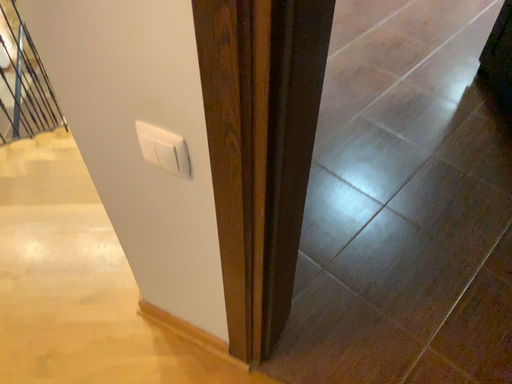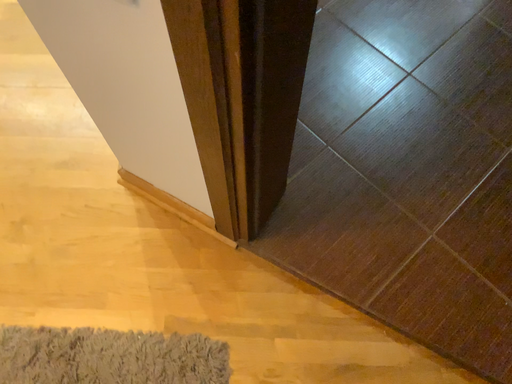
Question: How did the camera likely rotate when shooting the video?

Choices:
 (A) rotated downward
 (B) rotated upward

Answer: (A)